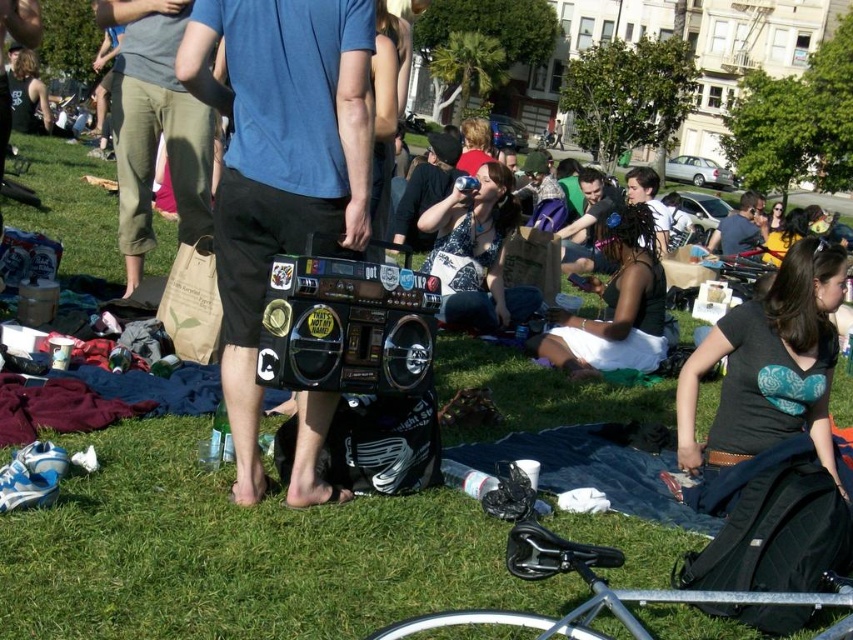
Question: Which of the following is the closest to the observer?

Choices:
 (A) blue cotton shirt at center
 (B) white lace dress at center

Answer: (A)

Question: Observing the image, what is the correct spatial positioning of silver metallic bicycle at lower center in reference to white lace dress at center?

Choices:
 (A) left
 (B) right

Answer: (A)

Question: In this image, where is matte black boombox at center located relative to shiny black boombox at center?

Choices:
 (A) left
 (B) right

Answer: (A)

Question: Can you confirm if matte black boombox at center is positioned to the left of matte purple shirt at center?

Choices:
 (A) no
 (B) yes

Answer: (B)

Question: Which point is closer to the camera?

Choices:
 (A) click(x=228, y=166)
 (B) click(x=714, y=452)
 (C) click(x=590, y=176)

Answer: (A)

Question: Which point is farther to the camera?

Choices:
 (A) blue cotton shirt at center
 (B) matte black boombox at center
 (C) black matte shirt at center
 (D) matte purple shirt at center

Answer: (D)